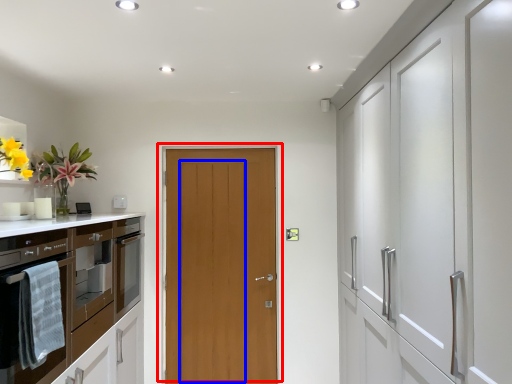
Question: Which of the following is the farthest to the observer, door (highlighted by a red box) or door (highlighted by a blue box)?

Choices:
 (A) door
 (B) door

Answer: (B)